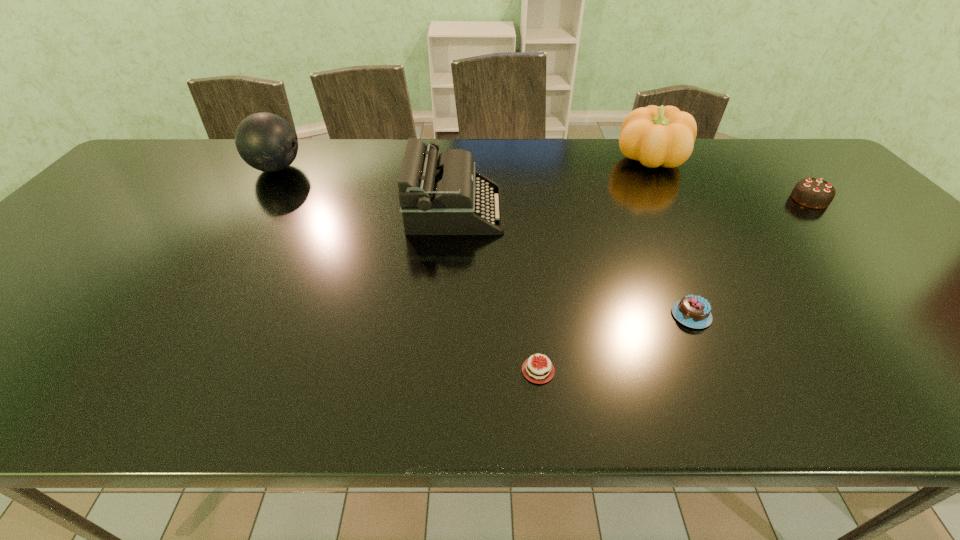
The image size is (960, 540). Find the location of `free space that satisfies the following two spatial constraints: 1. on the grip area of the bowling ball; 2. on the back side of the fifth farthest object`. free space that satisfies the following two spatial constraints: 1. on the grip area of the bowling ball; 2. on the back side of the fifth farthest object is located at coordinates (182, 315).

Find the location of a particular element. Image resolution: width=960 pixels, height=540 pixels. free location that satisfies the following two spatial constraints: 1. on the back side of the pumpkin; 2. on the right side of the shortest object is located at coordinates (515, 160).

Find the location of a particular element. vacant region that satisfies the following two spatial constraints: 1. on the grip area of the leftmost object; 2. on the right side of the nearest object is located at coordinates (147, 370).